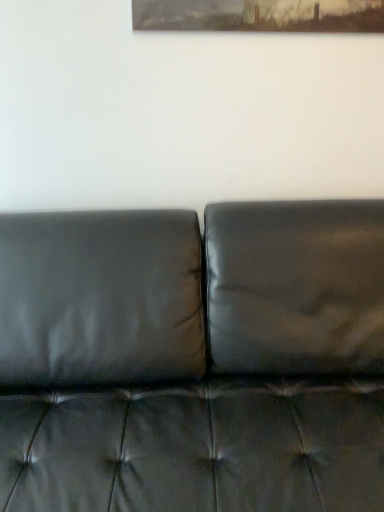
The image size is (384, 512). Describe the element at coordinates (193, 359) in the screenshot. I see `black leather couch at center` at that location.

Where is `black leather couch at center`? This screenshot has height=512, width=384. black leather couch at center is located at coordinates (193, 359).

Image resolution: width=384 pixels, height=512 pixels. What are the coordinates of `black leather couch at center` in the screenshot? It's located at (193, 359).